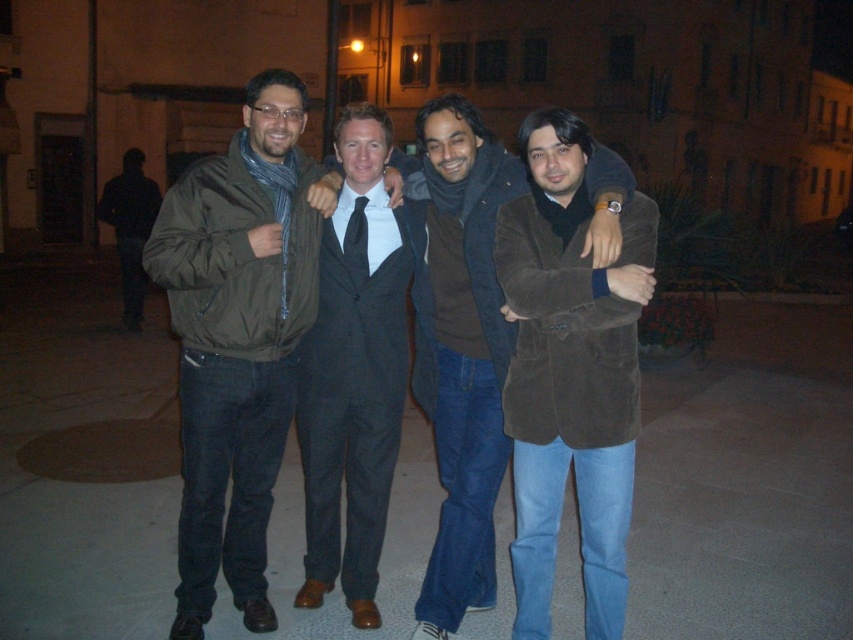
Question: Among these objects, which one is nearest to the camera?

Choices:
 (A) suede coat at center
 (B) matte black suit at center
 (C) matte olive green jacket at center
 (D) dark brown suit at center

Answer: (A)

Question: Can you confirm if matte olive green jacket at center is positioned below matte black suit at center?

Choices:
 (A) no
 (B) yes

Answer: (A)

Question: Is suede coat at center wider than matte black suit at center?

Choices:
 (A) yes
 (B) no

Answer: (A)

Question: Does matte olive green jacket at center come in front of dark brown suit at center?

Choices:
 (A) yes
 (B) no

Answer: (B)

Question: Which of these objects is positioned farthest from the suede coat at center?

Choices:
 (A) matte olive green jacket at center
 (B) matte black suit at center

Answer: (A)

Question: Which object appears farthest from the camera in this image?

Choices:
 (A) suede coat at center
 (B) matte black suit at center
 (C) matte olive green jacket at center
 (D) dark brown suit at center

Answer: (B)